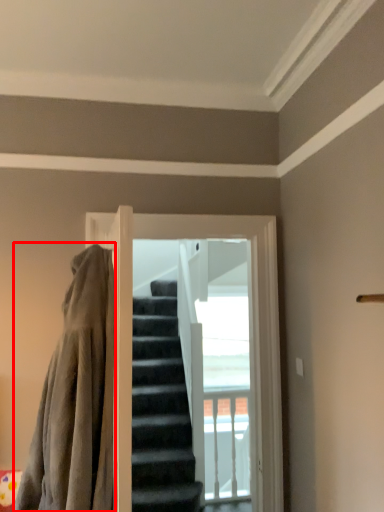
Question: From the image's perspective, considering the relative positions of blanket (annotated by the red box) and screen door in the image provided, where is blanket (annotated by the red box) located with respect to the staircase?

Choices:
 (A) below
 (B) above

Answer: (B)